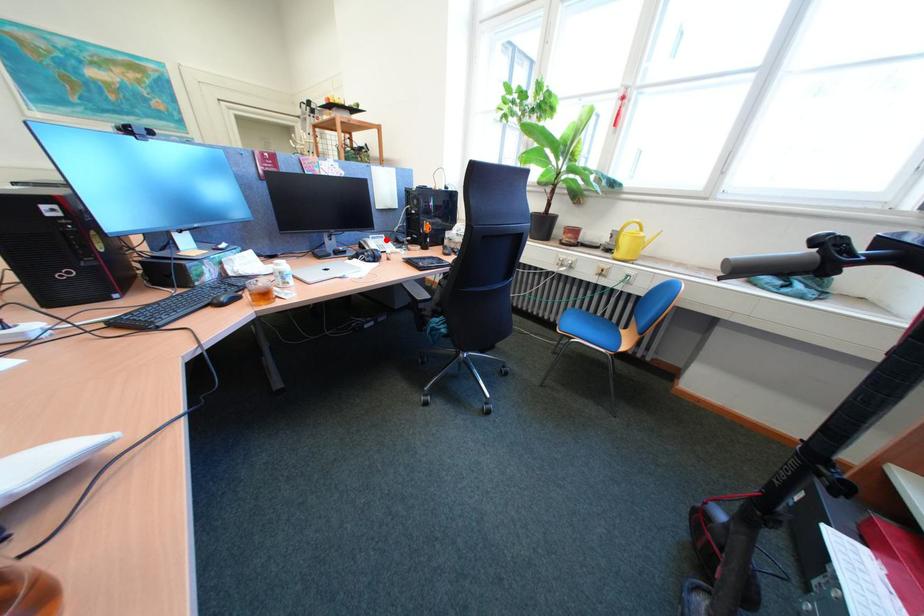
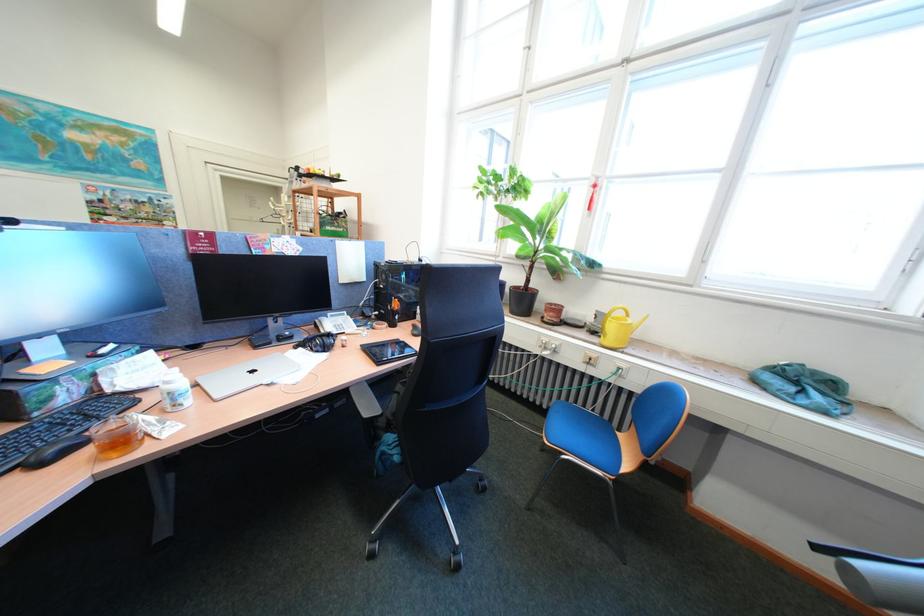
Find the pixel in the second image that matches the highlighted location in the first image.

(345, 318)